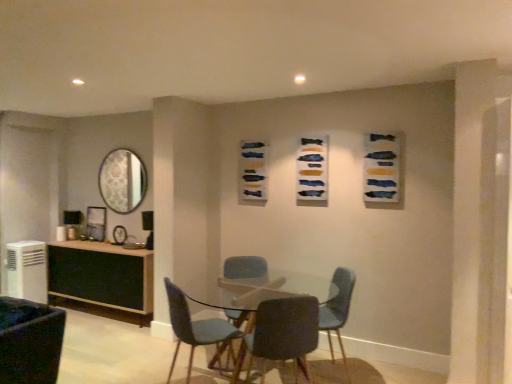
Question: Is matte blue chair at center, the third chair from the left, not near velvet blue chair at center, placed as the fourth chair when sorted from left to right?

Choices:
 (A) yes
 (B) no

Answer: (A)

Question: From the image's perspective, would you say matte blue chair at center, the third chair from the left, is shown under velvet blue chair at center, which is counted as the 2th chair, starting from the right?

Choices:
 (A) yes
 (B) no

Answer: (B)

Question: Can you confirm if matte blue chair at center, which is the third chair from right to left, is positioned to the right of velvet blue chair at center, placed as the fourth chair when sorted from left to right?

Choices:
 (A) no
 (B) yes

Answer: (A)

Question: Is matte blue chair at center, the third chair from the left, wider than velvet blue chair at center, placed as the fourth chair when sorted from left to right?

Choices:
 (A) no
 (B) yes

Answer: (A)

Question: Is matte blue chair at center, which is the third chair from right to left, aimed at velvet blue chair at center, placed as the fourth chair when sorted from left to right?

Choices:
 (A) yes
 (B) no

Answer: (A)

Question: Considering the relative sizes of matte blue chair at center, the third chair from the left, and velvet blue chair at center, placed as the fourth chair when sorted from left to right, in the image provided, is matte blue chair at center, the third chair from the left, taller than velvet blue chair at center, placed as the fourth chair when sorted from left to right,?

Choices:
 (A) no
 (B) yes

Answer: (B)

Question: Can you confirm if matte blue chair at center, the third chair from the left, is taller than textured fabric artwork at center, the third art when ordered from front to back?

Choices:
 (A) yes
 (B) no

Answer: (A)

Question: Can textured fabric artwork at center, which is counted as the 1th art, starting from the left, be found inside matte blue chair at center, the third chair from the left?

Choices:
 (A) yes
 (B) no

Answer: (B)

Question: Does matte blue chair at center, which is the third chair from right to left, turn towards textured fabric artwork at center, which is counted as the 1th art, starting from the left?

Choices:
 (A) yes
 (B) no

Answer: (B)

Question: From a real-world perspective, is matte blue chair at center, which is the third chair from right to left, below textured fabric artwork at center, the 1th art viewed from the back?

Choices:
 (A) yes
 (B) no

Answer: (A)

Question: From a real-world perspective, is matte blue chair at center, the third chair from the left, positioned over textured fabric artwork at center, placed as the third art when sorted from right to left, based on gravity?

Choices:
 (A) no
 (B) yes

Answer: (A)

Question: Considering the relative sizes of matte blue chair at center, the third chair from the left, and textured fabric artwork at center, placed as the third art when sorted from right to left, in the image provided, is matte blue chair at center, the third chair from the left, smaller than textured fabric artwork at center, placed as the third art when sorted from right to left,?

Choices:
 (A) no
 (B) yes

Answer: (A)

Question: Is textured fabric artwork at center, the third art when ordered from front to back, not near clear glass table at center?

Choices:
 (A) yes
 (B) no

Answer: (A)